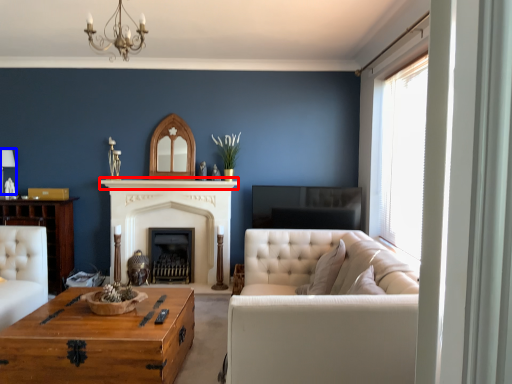
Question: Which object appears closest to the camera in this image, mantle (highlighted by a red box) or lamp (highlighted by a blue box)?

Choices:
 (A) mantle
 (B) lamp

Answer: (B)